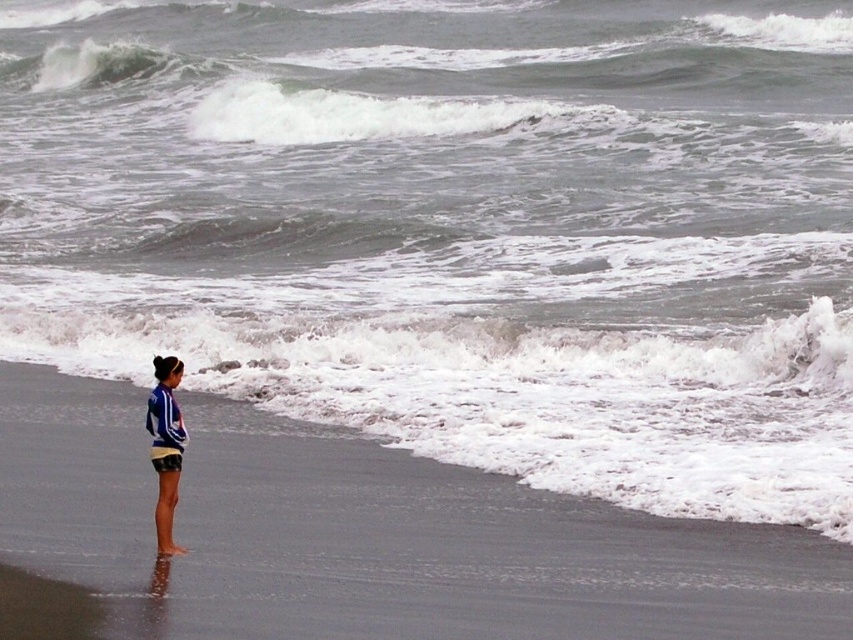
You are standing on the beach and see a person wearing a blue striped shirt at lower left and a smooth sand beach at lower left. Which object is positioned to the right of the other?

The smooth sand beach at lower left is to the right of the blue striped shirt at lower left.

You are standing on the beach and see the smooth sand beach at lower left and the blue striped shirt at lower left. Which object is closer to you?

The smooth sand beach at lower left is closer to the viewer than the blue striped shirt at lower left.

You are standing on the beach and see the smooth sand beach at lower left and the blue striped shirt at lower left. Which one is taller?

The blue striped shirt at lower left is taller than the smooth sand beach at lower left.